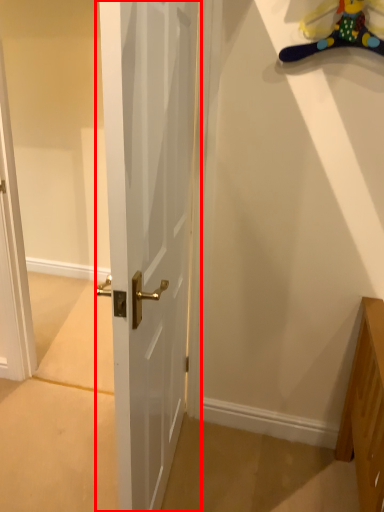
Question: From the image, what is the correct spatial relationship of door (annotated by the red box) in relation to toy?

Choices:
 (A) left
 (B) right

Answer: (A)